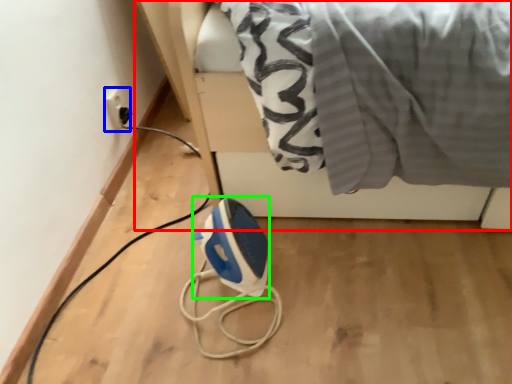
Question: Which object is the farthest from furniture (highlighted by a red box)? Choose among these: electric outlet (highlighted by a blue box) or appliance (highlighted by a green box).

Choices:
 (A) electric outlet
 (B) appliance

Answer: (A)